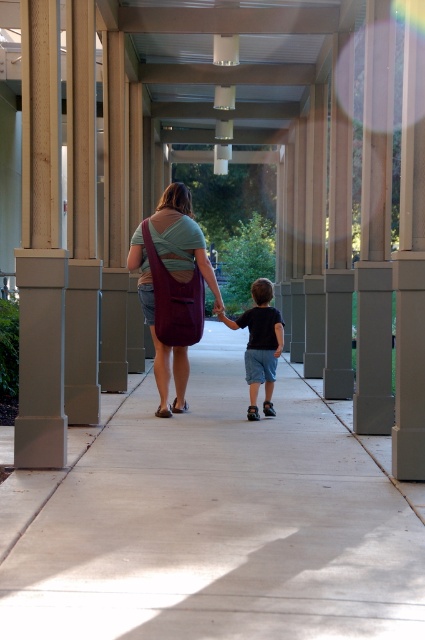
You are a maintenance worker who needs to place a 5 feet long ladder between the smooth gray pillar at left and the matte purple bag at center. Can the ladder fit in the space between them?

The distance between the smooth gray pillar at left and the matte purple bag at center is 7.51 feet, which is greater than the ladder length of 5 feet. Therefore, the ladder can fit in the space between them.

You are a painter standing in front of the smooth gray pillar at left and the matte purple bag at center. You need to paint the larger object. Which one should you choose?

The matte purple bag at center is larger than the smooth gray pillar at left, so you should paint the matte purple bag at center.